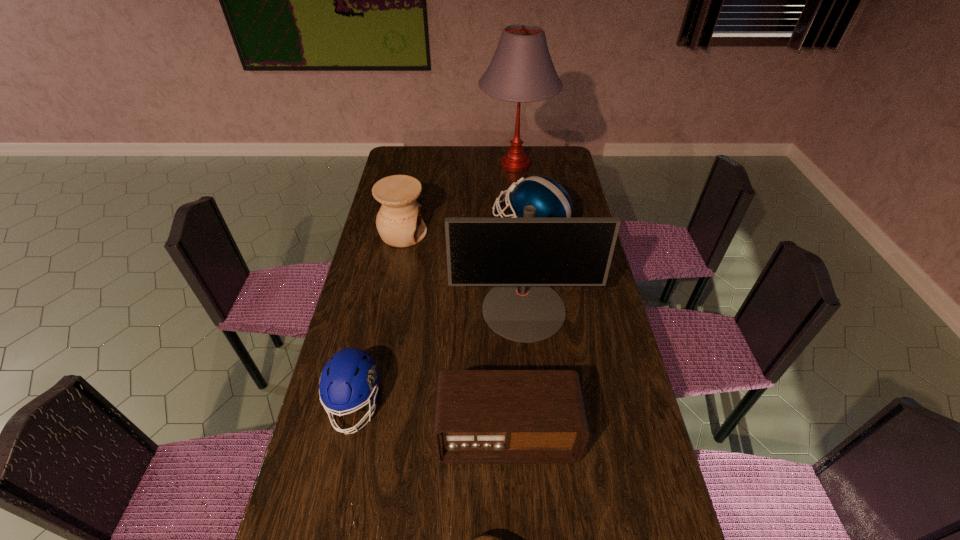
Locate an element on the screen. This screenshot has width=960, height=540. object that is at the far edge is located at coordinates (521, 70).

Identify the location of pottery that is at the left edge. The height and width of the screenshot is (540, 960). (399, 222).

In order to click on football helmet positioned at the left edge in this screenshot , I will do `click(350, 378)`.

Where is `table lamp that is positioned at the right edge`? table lamp that is positioned at the right edge is located at coordinates (521, 70).

Where is `computer monitor that is at the right edge`? This screenshot has width=960, height=540. computer monitor that is at the right edge is located at coordinates (521, 257).

You are a GUI agent. You are given a task and a screenshot of the screen. Output one action in this format:
    pyautogui.click(x=<x>, y=<y>)
    Task: Click on the football helmet that is at the right edge
    This screenshot has height=540, width=960.
    Given the screenshot: What is the action you would take?
    pyautogui.click(x=551, y=200)

I want to click on object present at the far right corner, so click(x=521, y=70).

The height and width of the screenshot is (540, 960). I want to click on vacant space at the far edge of the desktop, so point(486,154).

Where is `blank space at the left edge of the desktop`? blank space at the left edge of the desktop is located at coordinates (356, 511).

Find the location of a particular element. Image resolution: width=960 pixels, height=540 pixels. free spot at the right edge of the desktop is located at coordinates (562, 177).